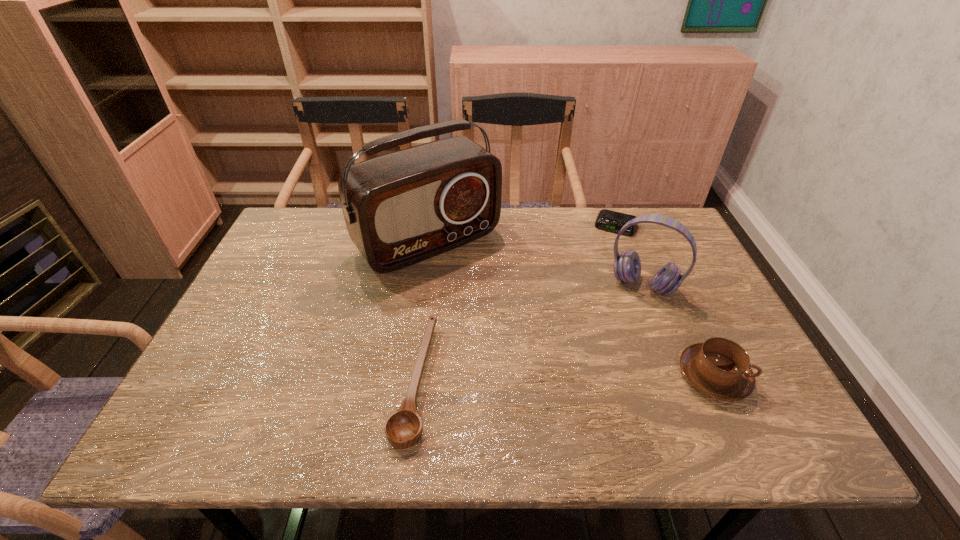
Identify the location of vacant space located on the front panel of the radio receiver. (506, 317).

Identify the location of free point located 0.380m on the front panel of the radio receiver. (555, 369).

The height and width of the screenshot is (540, 960). What are the coordinates of `blank space located on the headband and ear cups of the headset` in the screenshot? It's located at (587, 402).

Find the location of `vacant space located on the headband and ear cups of the headset`. vacant space located on the headband and ear cups of the headset is located at coordinates point(609,353).

What are the coordinates of `vacant point located on the headband and ear cups of the headset` in the screenshot? It's located at (609, 353).

Identify the location of alarm clock at the far edge. (608, 220).

Locate an element on the screen. Image resolution: width=960 pixels, height=540 pixels. radio receiver that is at the far edge is located at coordinates (401, 208).

Find the location of a particular element. This screenshot has height=540, width=960. wooden spoon that is at the near edge is located at coordinates (403, 428).

At what (x,y) coordinates should I click in order to perform the action: click on cappuccino at the near edge. Please return your answer as a coordinate pair (x, y). This screenshot has width=960, height=540. Looking at the image, I should click on (719, 368).

Identify the location of cappuccino that is at the right edge. This screenshot has width=960, height=540. (719, 368).